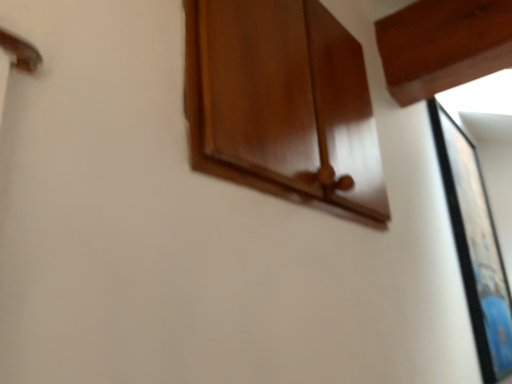
Question: Should I look upward or downward to see glossy wood cabinet at upper center?

Choices:
 (A) up
 (B) down

Answer: (A)

Question: From the image's perspective, does glossy wood cabinet at upper center appear lower than black glossy picture frame at right?

Choices:
 (A) no
 (B) yes

Answer: (A)

Question: Is glossy wood cabinet at upper center at the left side of black glossy picture frame at right?

Choices:
 (A) no
 (B) yes

Answer: (B)

Question: Does glossy wood cabinet at upper center come behind black glossy picture frame at right?

Choices:
 (A) yes
 (B) no

Answer: (B)

Question: Considering the relative sizes of glossy wood cabinet at upper center and black glossy picture frame at right in the image provided, is glossy wood cabinet at upper center smaller than black glossy picture frame at right?

Choices:
 (A) yes
 (B) no

Answer: (A)

Question: Considering the relative positions of glossy wood cabinet at upper center and black glossy picture frame at right in the image provided, is glossy wood cabinet at upper center to the right of black glossy picture frame at right from the viewer's perspective?

Choices:
 (A) no
 (B) yes

Answer: (A)

Question: Is the surface of glossy wood cabinet at upper center in direct contact with black glossy picture frame at right?

Choices:
 (A) yes
 (B) no

Answer: (B)

Question: Does black glossy picture frame at right have a greater height compared to glossy wood cabinet at upper center?

Choices:
 (A) no
 (B) yes

Answer: (B)

Question: Is black glossy picture frame at right next to glossy wood cabinet at upper center and touching it?

Choices:
 (A) yes
 (B) no

Answer: (B)

Question: Can you confirm if black glossy picture frame at right is positioned to the right of glossy wood cabinet at upper center?

Choices:
 (A) no
 (B) yes

Answer: (B)

Question: Is black glossy picture frame at right not close to glossy wood cabinet at upper center?

Choices:
 (A) no
 (B) yes

Answer: (B)

Question: Is black glossy picture frame at right in front of glossy wood cabinet at upper center?

Choices:
 (A) yes
 (B) no

Answer: (B)

Question: Does black glossy picture frame at right have a smaller size compared to glossy wood cabinet at upper center?

Choices:
 (A) no
 (B) yes

Answer: (A)

Question: In terms of width, does black glossy picture frame at right look wider or thinner when compared to glossy wood cabinet at upper center?

Choices:
 (A) thin
 (B) wide

Answer: (B)